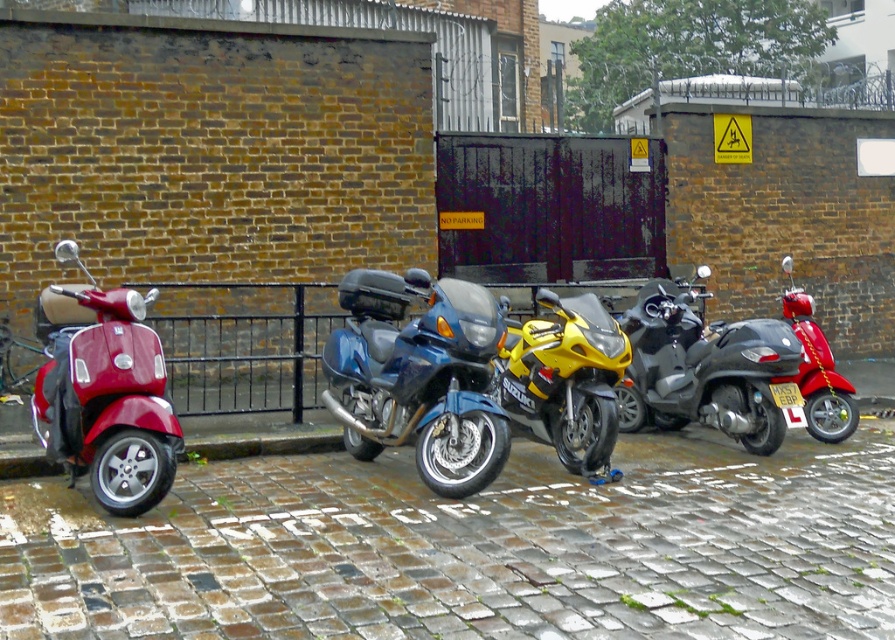
Question: Does brown cobblestone pavement at lower left appear over shiny black scooter at center?

Choices:
 (A) yes
 (B) no

Answer: (B)

Question: Is shiny red scooter at left positioned before shiny red scooter at right?

Choices:
 (A) no
 (B) yes

Answer: (B)

Question: Among these points, which one is farthest from the camera?

Choices:
 (A) (507, 326)
 (B) (444, 417)
 (C) (859, 592)

Answer: (A)

Question: Is shiny red scooter at left smaller than yellow metallic motorcycle at center?

Choices:
 (A) yes
 (B) no

Answer: (B)

Question: Which point appears closest to the camera in this image?

Choices:
 (A) (621, 429)
 (B) (540, 380)

Answer: (B)

Question: Which point is farther to the camera?

Choices:
 (A) yellow metallic motorcycle at center
 (B) blue metallic motorcycle at center

Answer: (A)